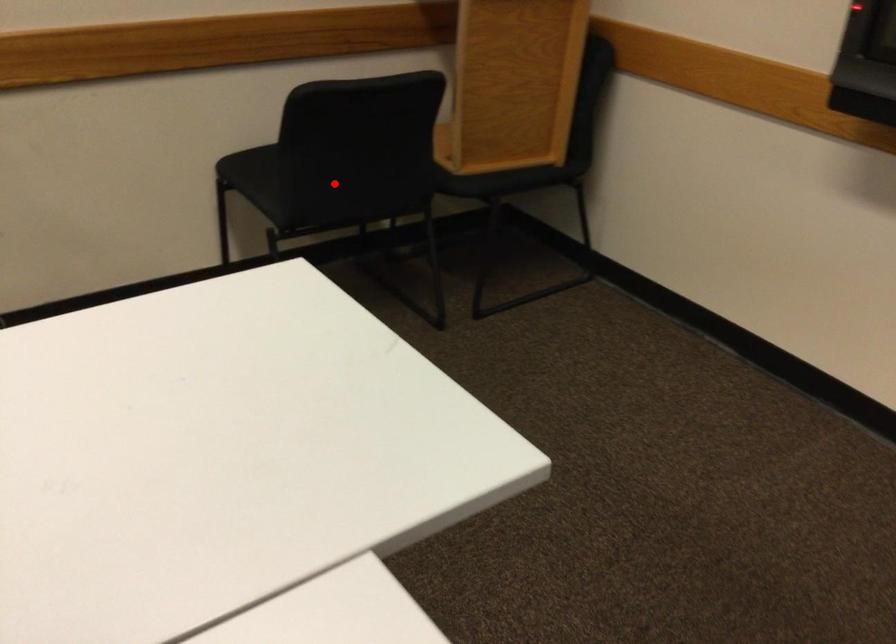
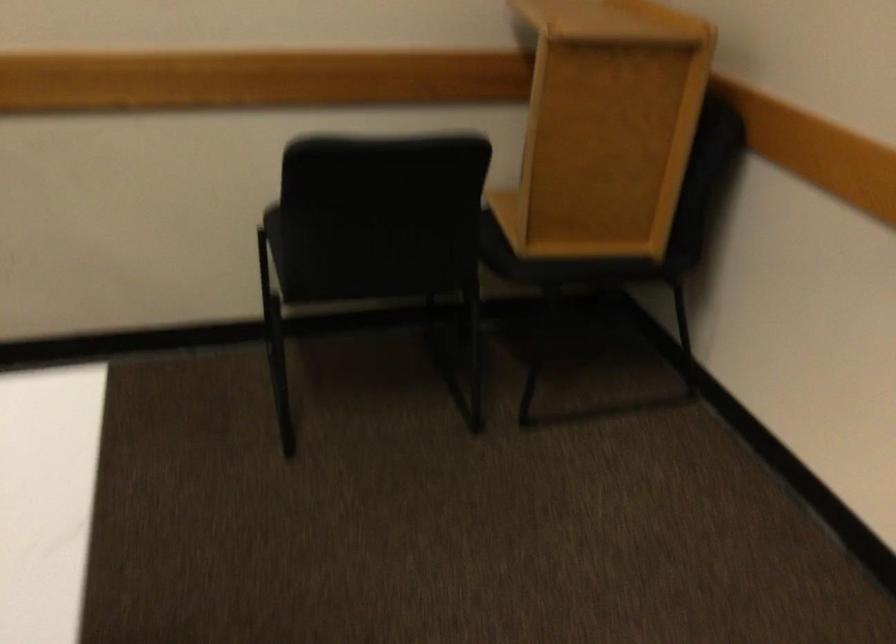
In the second image, find the point that corresponds to the highlighted location in the first image.

(348, 250)